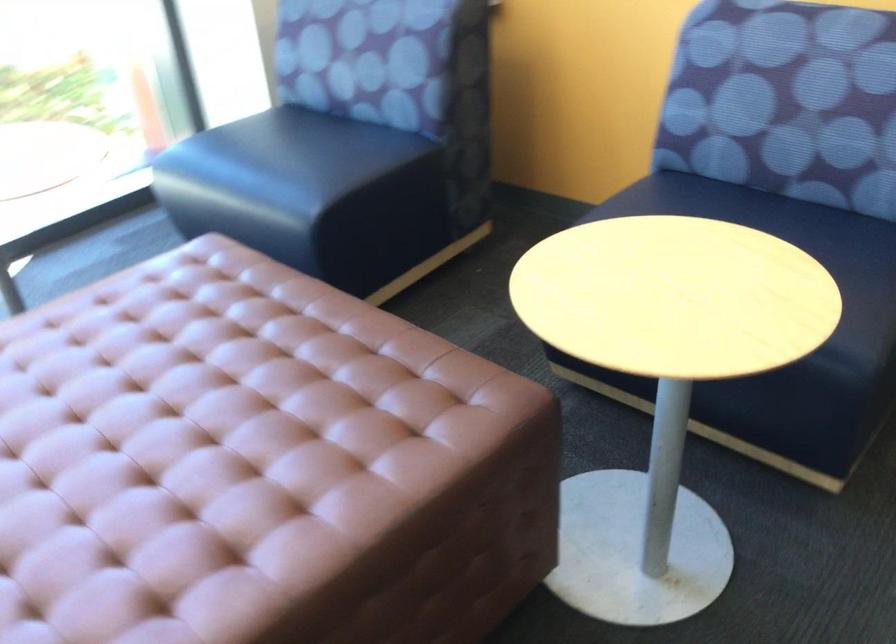
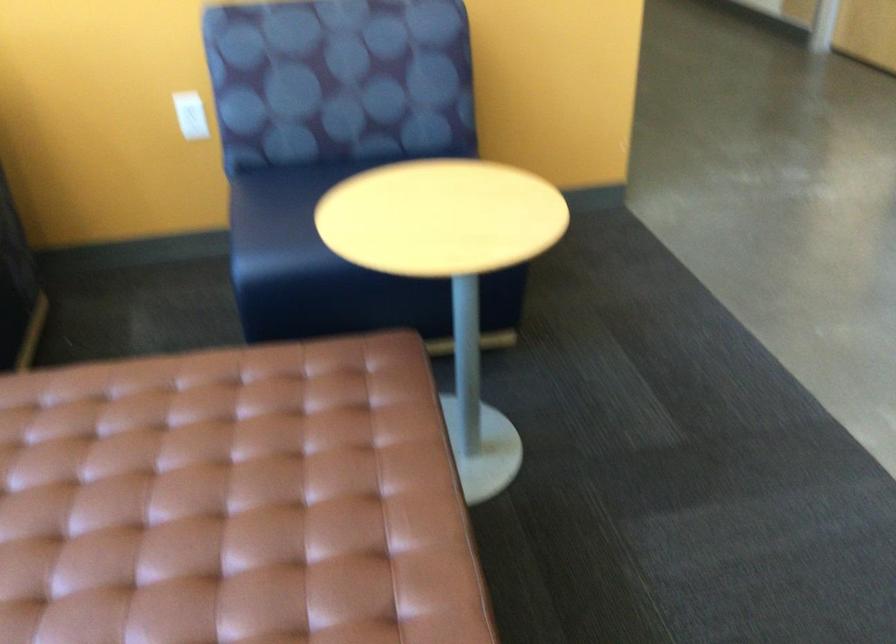
Where in the second image is the point corresponding to point (226, 442) from the first image?

(231, 502)